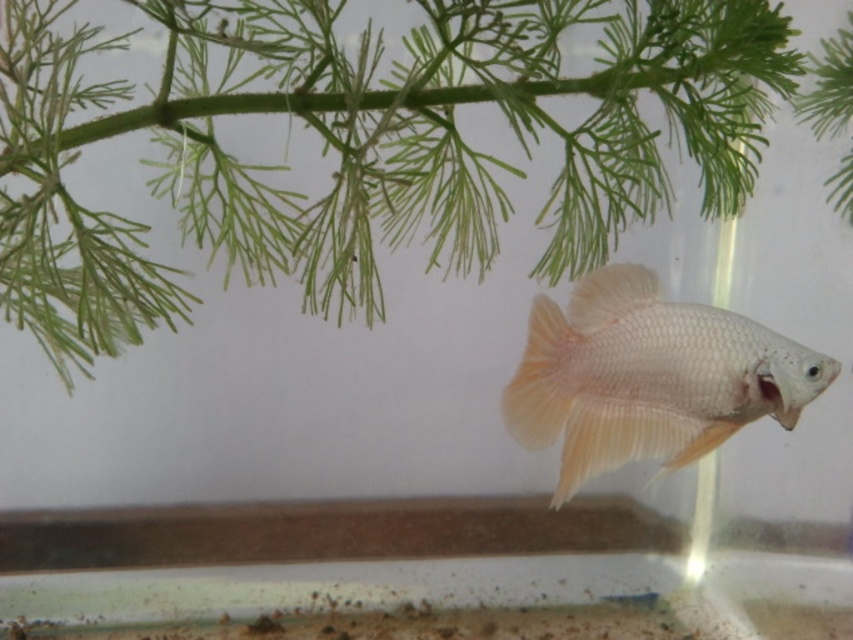
Question: Which point is farther to the camera?

Choices:
 (A) 462,193
 (B) 631,294

Answer: (A)

Question: Which object is farther from the camera taking this photo?

Choices:
 (A) green leafy plant at upper center
 (B) translucent white fish at center

Answer: (A)

Question: Among these objects, which one is farthest from the camera?

Choices:
 (A) translucent white fish at center
 (B) green leafy plant at upper center

Answer: (B)

Question: Is green leafy plant at upper center further to the viewer compared to translucent white fish at center?

Choices:
 (A) no
 (B) yes

Answer: (B)

Question: Is green leafy plant at upper center below translucent white fish at center?

Choices:
 (A) no
 (B) yes

Answer: (A)

Question: Does green leafy plant at upper center appear under translucent white fish at center?

Choices:
 (A) no
 (B) yes

Answer: (A)